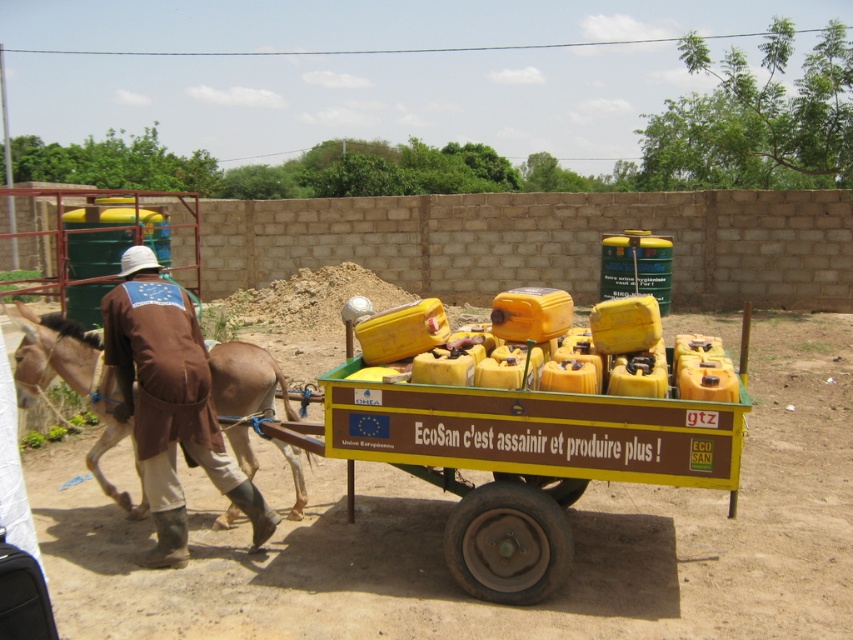
You are a photographer trying to capture the man and the donkey in the scene. You notice the brown fabric jacket at left and the brown leather mule at left. Which item should you focus on first if you want to photograph the smaller one?

The brown fabric jacket at left has a smaller size compared to the brown leather mule at left, so you should focus on the brown fabric jacket at left first.

Based on the photo, you are a photographer trying to capture the man and the donkey in the scene. Since you want to ensure both the brown fabric jacket at left and the brown leather mule at left are visible in the frame, which object should you focus on to ensure the entire width of both is captured?

You should focus on the brown fabric jacket at left because it might be wider than the brown leather mule at left, so capturing its width would ensure the mule is also in frame.